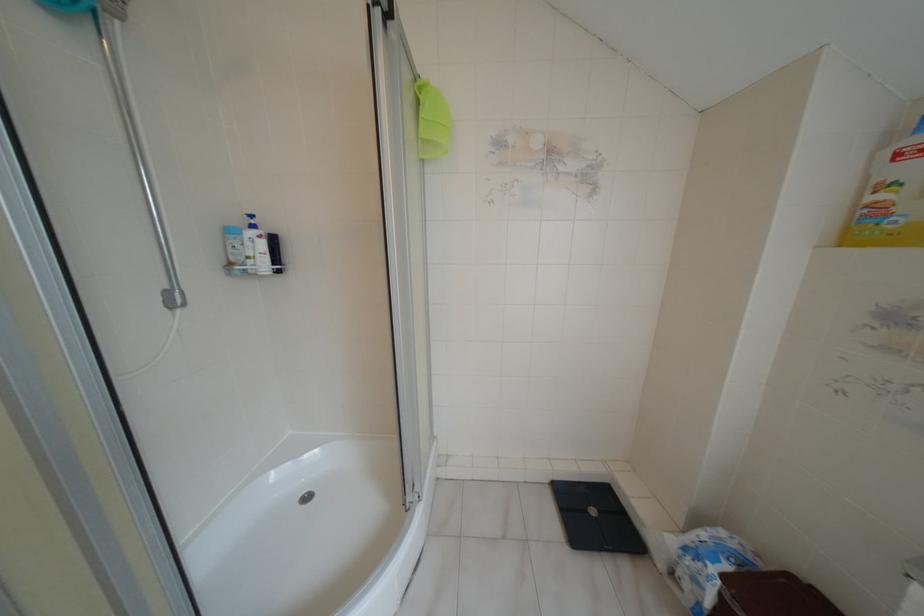
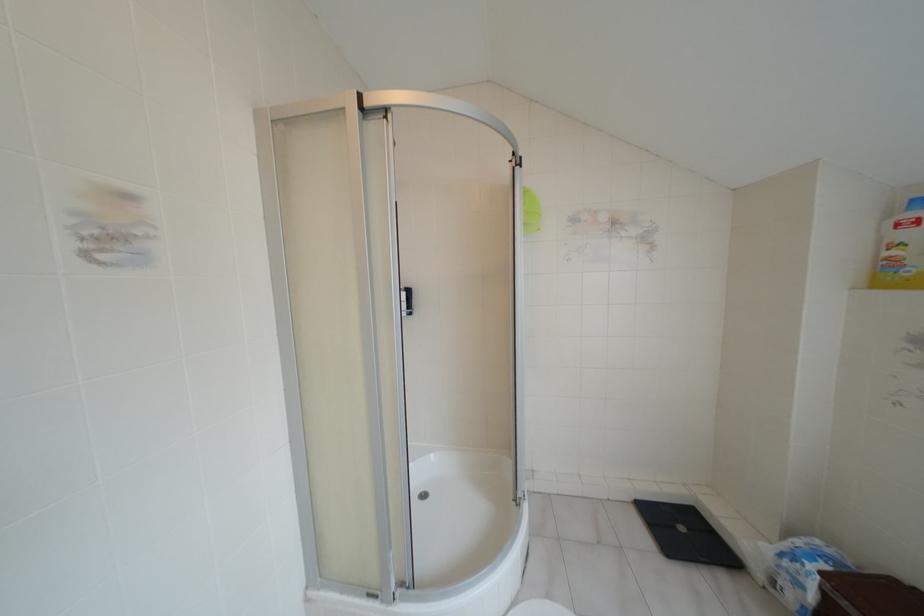
Question: How did the camera likely rotate?

Choices:
 (A) Left
 (B) Right
 (C) Up
 (D) Down

Answer: (C)